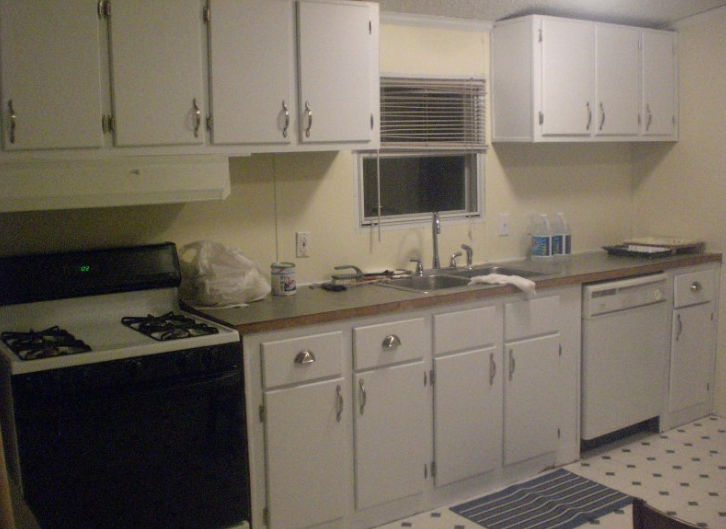
Locate an element on the screen. The image size is (726, 529). sink is located at coordinates (439, 273).